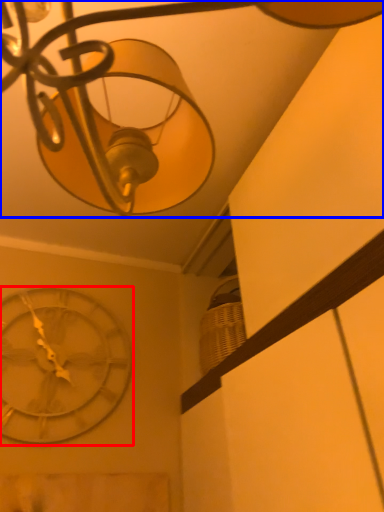
Question: Among these objects, which one is nearest to the camera, wall clock (highlighted by a red box) or lamp (highlighted by a blue box)?

Choices:
 (A) wall clock
 (B) lamp

Answer: (B)